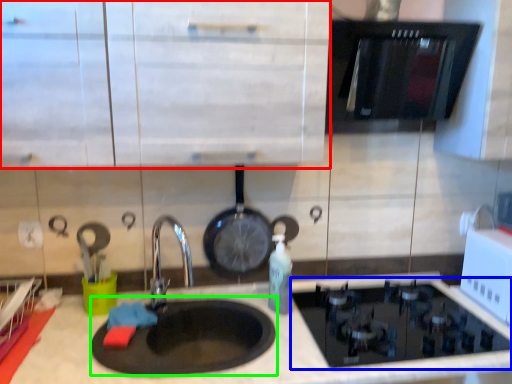
Question: Which object is the closest to the cabinetry (highlighted by a red box)? Choose among these: gas stove (highlighted by a blue box) or pizza pan (highlighted by a green box).

Choices:
 (A) gas stove
 (B) pizza pan

Answer: (B)